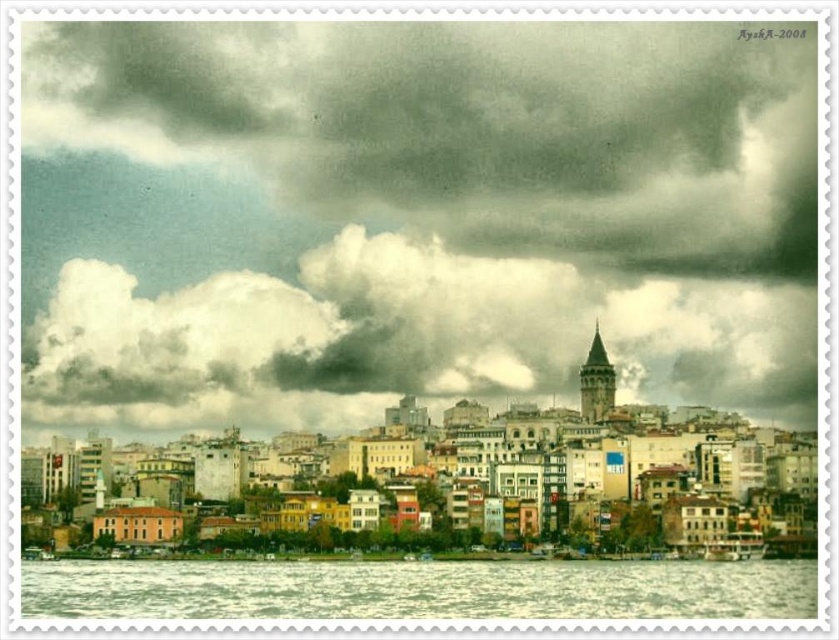
Based on the scene description, where is the point located at coordinates [391,337]?

The point at coordinates [391,337] corresponds to the cloudy sky at upper center.

You are standing in the cityscape scene and want to move from point A to point B. Point A is located at coordinates point (720, 298) and point B is at point (98, 580). Which point is closer to you as you stand in the scene?

Point (720, 298) is closer to you than point (98, 580) because it is further to the viewer.